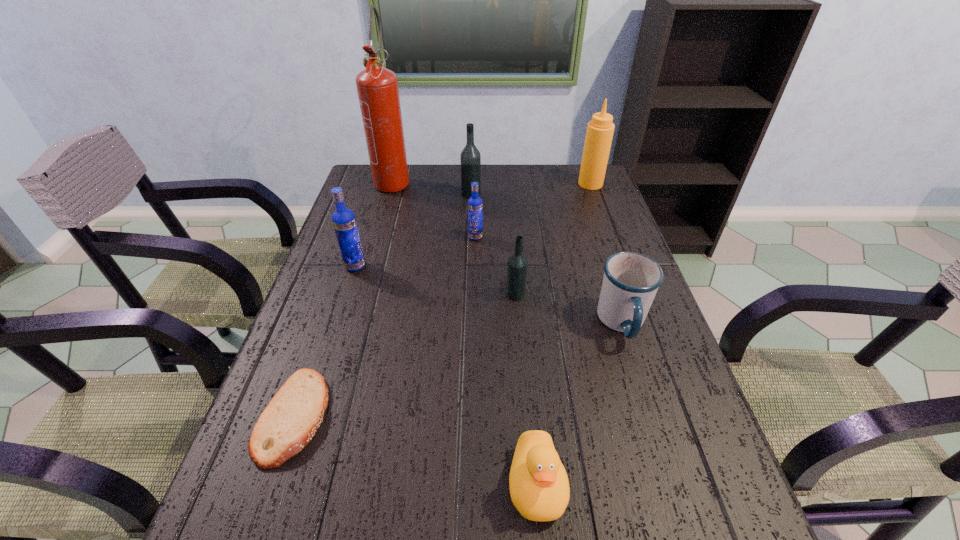
At what (x,y) coordinates should I click in order to perform the action: click on free spot between the pita bread and the tan condiment. Please return your answer as a coordinate pair (x, y). Looking at the image, I should click on (443, 300).

Find the location of a particular element. Image resolution: width=960 pixels, height=540 pixels. free space that is in between the tallest object and the third farthest vodka is located at coordinates (374, 223).

Image resolution: width=960 pixels, height=540 pixels. Identify the location of free space between the eighth shortest object and the duck. (564, 334).

At what (x,y) coordinates should I click in order to perform the action: click on free space that is in between the yellow duck and the nearer blue vodka. Please return your answer as a coordinate pair (x, y). The width and height of the screenshot is (960, 540). Looking at the image, I should click on (446, 375).

You are a GUI agent. You are given a task and a screenshot of the screen. Output one action in this format:
    pyautogui.click(x=<x>, y=<y>)
    Task: Click on the free space between the leftmost vodka and the third nearest vodka
    The height and width of the screenshot is (540, 960).
    Given the screenshot: What is the action you would take?
    pyautogui.click(x=415, y=252)

Find the location of a particular element. empty location between the third nearest vodka and the yellow duck is located at coordinates (506, 360).

Where is `vacant space in between the bigger black vodka and the yellow duck`? The width and height of the screenshot is (960, 540). vacant space in between the bigger black vodka and the yellow duck is located at coordinates (504, 339).

Locate an element on the screen. object that stands as the sixth closest to the smaller blue vodka is located at coordinates (599, 134).

Where is `the second closest object to the red fire extinguisher`? Image resolution: width=960 pixels, height=540 pixels. the second closest object to the red fire extinguisher is located at coordinates click(475, 204).

I want to click on vodka that is the third nearest to the nearest vodka, so click(x=470, y=158).